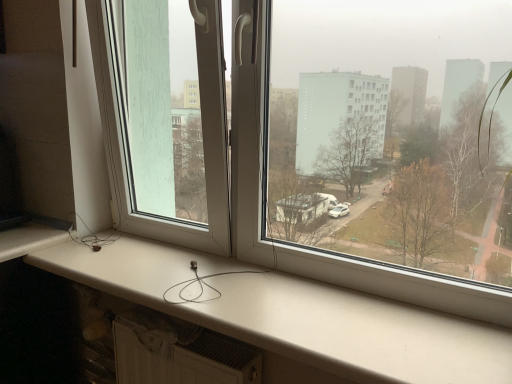
Locate an element on the screen. This screenshot has height=384, width=512. vacant area located to the right-hand side of transparent plastic window screen at left is located at coordinates [210, 268].